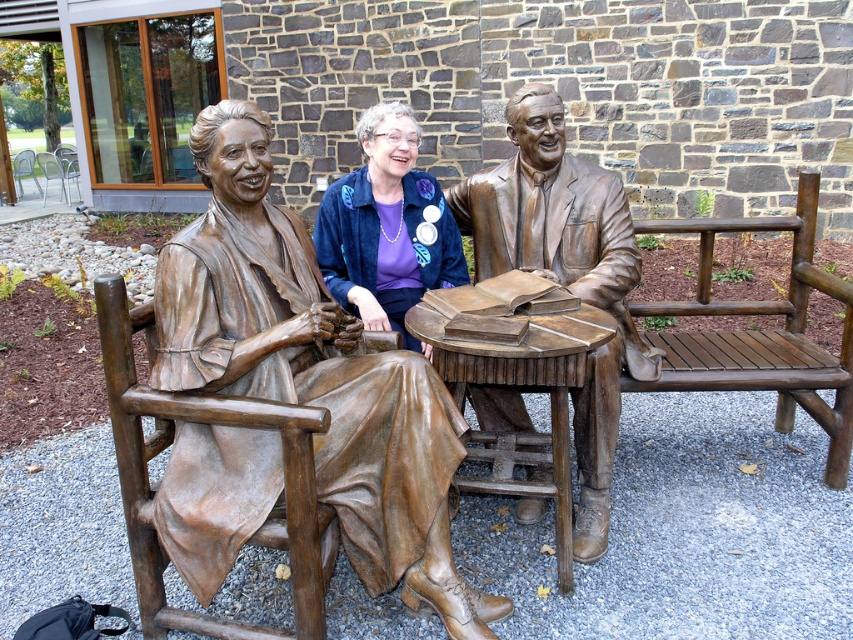
You are an art curator planning to move the bronze statue of man at center and the blue velvet jacket at center to a new exhibition space. The new space has a height restriction of 1.8 meters. Can both items be displayed without any modifications?

The bronze statue of man at center is larger in size than the blue velvet jacket at center. Since the statue is larger, it might exceed the 1.8 meter height restriction. The blue velvet jacket at center could potentially fit, but the statue may need modification or a different display area.

You are an artist trying to sketch the scene. You need to determine the relative sizes of the bronze statue at center and the blue velvet jacket at center to ensure proper proportions in your drawing. Which object is bigger?

The bronze statue at center is larger in size than the blue velvet jacket at center, so the statue should be drawn bigger than the jacket.

You are a tour guide leading a group to the bronze statue at center. The group wants to take a photo with the statue. There is a 6 feet wide path in front of the statue. Can the group safely take the photo without blocking the path?

The bronze statue at center is 6.28 feet apart from the group. The path is 6 feet wide, so the group needs to stand at least 0.28 feet away from the statue to avoid blocking the path. However, this distance might be too close for a group photo. It is recommended to position the group further back to ensure the entire group fits in the frame while keeping the path clear.